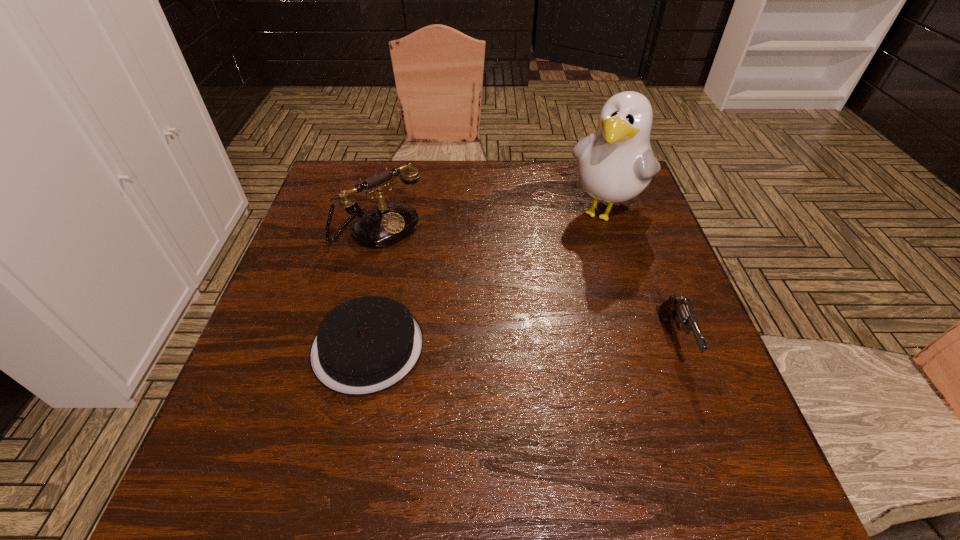
Identify the location of vacant space on the desktop that is between the shortest object and the third tallest object and is positioned on the dial of the second tallest object. The height and width of the screenshot is (540, 960). 511,345.

The width and height of the screenshot is (960, 540). In order to click on free space on the desktop that is between the pancake and the pistol and is positioned on the beak of the gull in this screenshot , I will do `click(507, 345)`.